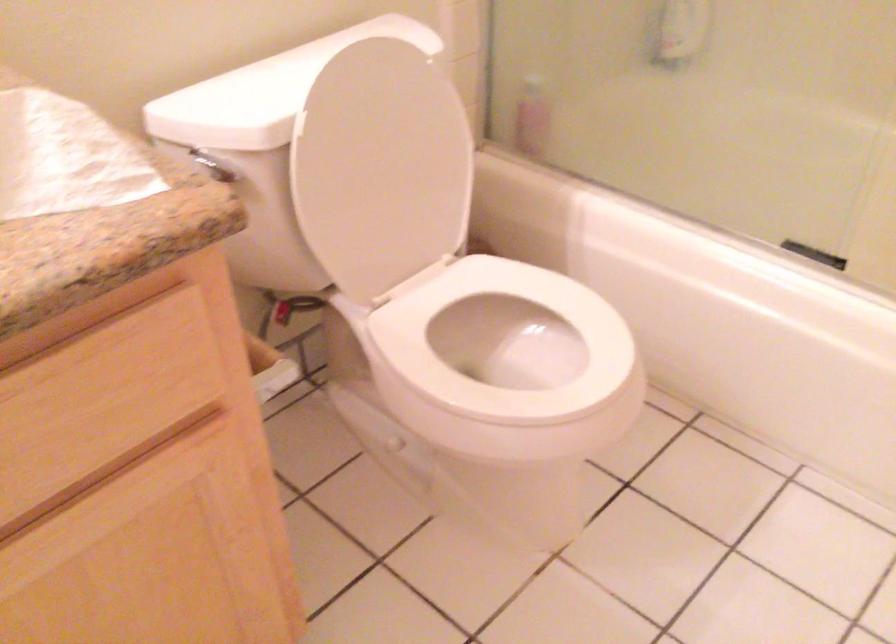
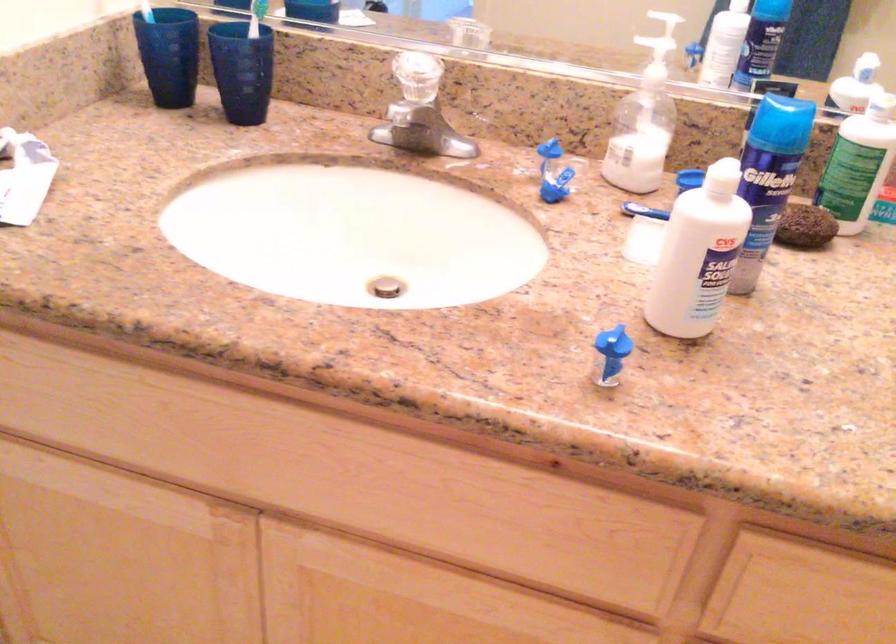
Question: The images are taken continuously from a first-person perspective. In which direction is your viewpoint rotating?

Choices:
 (A) Left
 (B) Right
 (C) Up
 (D) Down

Answer: (A)